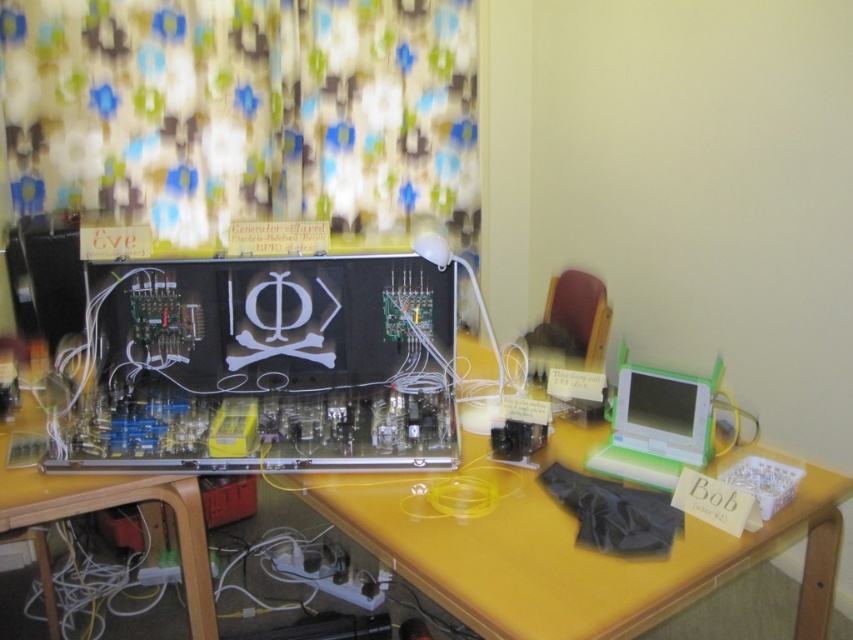
Question: Can you confirm if floral fabric curtain at upper left is positioned to the left of matte black circuit board at center?

Choices:
 (A) no
 (B) yes

Answer: (B)

Question: Considering the real-world distances, which object is farthest from the white plastic laptop at right?

Choices:
 (A) floral fabric curtain at upper left
 (B) yellow plastic computer desk at center
 (C) matte black circuit board at center

Answer: (A)

Question: Among these objects, which one is farthest from the camera?

Choices:
 (A) floral fabric curtain at upper left
 (B) matte black circuit board at center
 (C) white plastic laptop at right
 (D) yellow plastic computer desk at center

Answer: (A)

Question: Which object is the closest to the floral fabric curtain at upper left?

Choices:
 (A) white plastic laptop at right
 (B) yellow plastic computer desk at center

Answer: (B)

Question: Does matte black circuit board at center appear over white plastic laptop at right?

Choices:
 (A) yes
 (B) no

Answer: (A)

Question: Is floral fabric curtain at upper left above matte black circuit board at center?

Choices:
 (A) no
 (B) yes

Answer: (B)